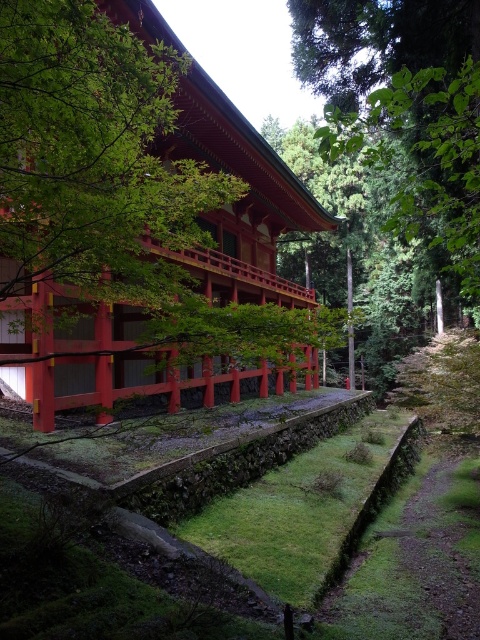
Question: Can you confirm if green leafy tree at center is bigger than green leafy tree at upper center?

Choices:
 (A) yes
 (B) no

Answer: (B)

Question: Which of the following is the farthest from the observer?

Choices:
 (A) (374, 129)
 (B) (189, 324)

Answer: (A)

Question: Can you confirm if green leafy tree at center is positioned to the right of green leafy tree at upper center?

Choices:
 (A) no
 (B) yes

Answer: (A)

Question: Does green leafy tree at center appear under green leafy tree at upper center?

Choices:
 (A) yes
 (B) no

Answer: (A)